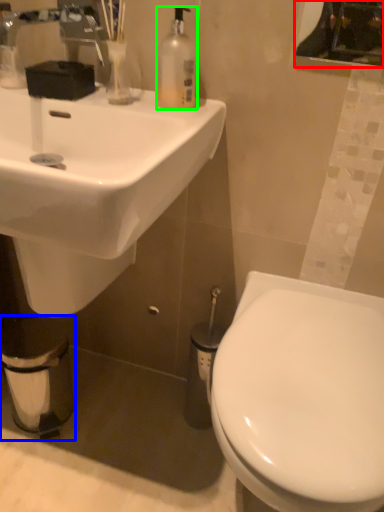
Question: Which is farther away from mirror (highlighted by a red box)? toilet paper (highlighted by a blue box) or bottle (highlighted by a green box)?

Choices:
 (A) toilet paper
 (B) bottle

Answer: (A)